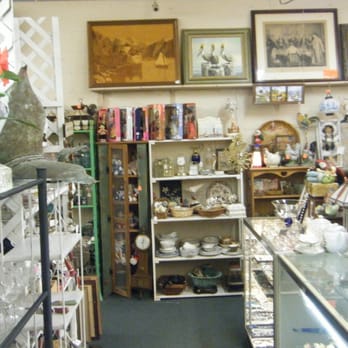
Identify the location of lamp. The image size is (348, 348). (327, 111).